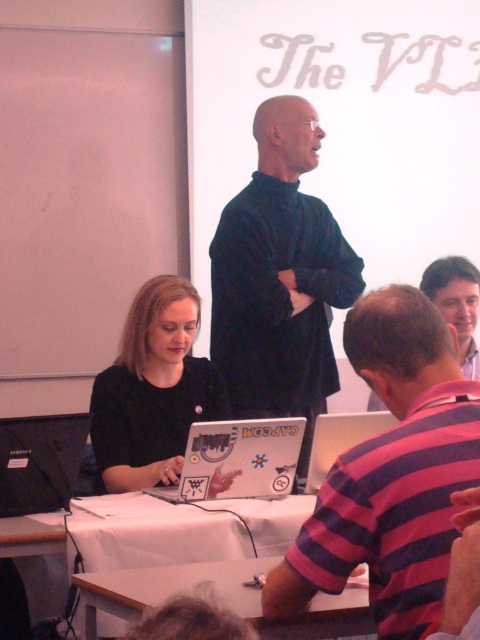
You are standing in the workshop and want to locate the black matte sweater at center. According to the coordinates provided, where exactly should you look?

You should look at point 0.436 on the x axis and 0.583 on the y axis to find the black matte sweater at center.

You are an assistant at the event. You need to retrieve the white glossy laptop at center from under the black matte sweater at center. Is the laptop accessible without moving the sweater?

The black matte sweater at center is positioned over the white glossy laptop at center, so you will need to move the sweater to access the laptop.